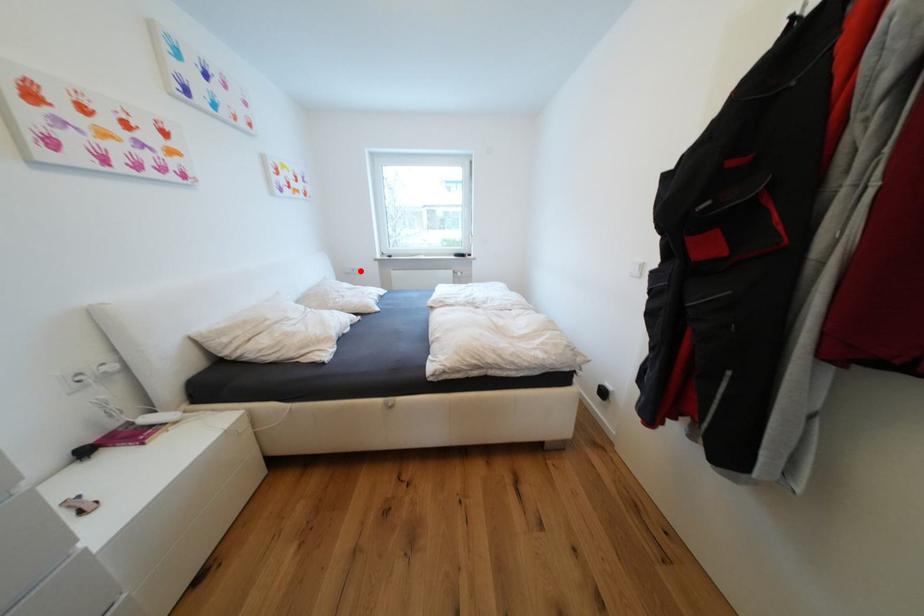
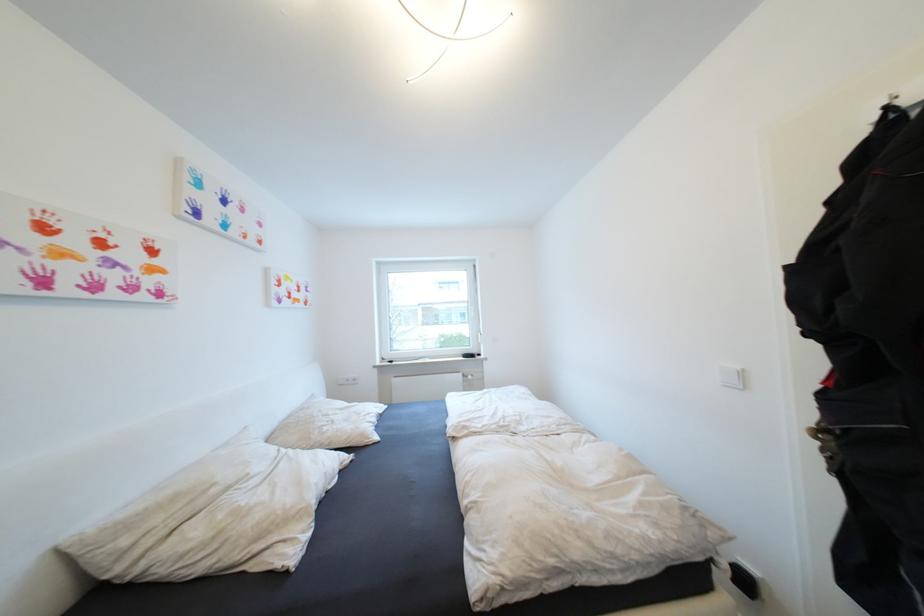
Question: I am providing you with two images of the same scene from different viewpoints. A red point is shown in image1. For the corresponding object point in image2, is it positioned nearer or farther from the camera?

Choices:
 (A) Nearer
 (B) Farther

Answer: (B)